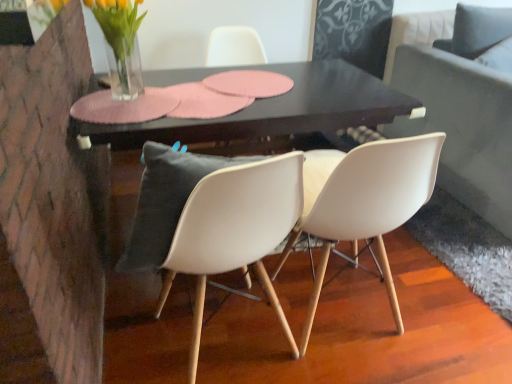
Question: Does white plastic chair at center, acting as the third chair starting from the front, have a greater height compared to clear glass vase at upper left?

Choices:
 (A) no
 (B) yes

Answer: (B)

Question: Can you confirm if white plastic chair at center, the first chair from the back, is bigger than clear glass vase at upper left?

Choices:
 (A) yes
 (B) no

Answer: (A)

Question: Is white plastic chair at center, the first chair from the back, positioned behind clear glass vase at upper left?

Choices:
 (A) no
 (B) yes

Answer: (B)

Question: Can you confirm if white plastic chair at center, the first chair from the back, is thinner than clear glass vase at upper left?

Choices:
 (A) yes
 (B) no

Answer: (B)

Question: From a real-world perspective, is white plastic chair at center, the first chair from the back, on top of clear glass vase at upper left?

Choices:
 (A) yes
 (B) no

Answer: (B)

Question: In terms of size, does white plastic chair at center, the 3th chair viewed from the back, appear bigger or smaller than dark gray fabric couch at right?

Choices:
 (A) small
 (B) big

Answer: (A)

Question: Is point [261, 244] closer or farther from the camera than point [468, 64]?

Choices:
 (A) closer
 (B) farther

Answer: (A)

Question: Relative to dark gray fabric couch at right, is white plastic chair at center, the first chair in the front-to-back sequence, in front or behind?

Choices:
 (A) behind
 (B) front

Answer: (B)

Question: Is white plastic chair at center, the 3th chair viewed from the back, spatially inside dark gray fabric couch at right, or outside of it?

Choices:
 (A) inside
 (B) outside

Answer: (B)

Question: From their relative heights in the image, would you say white plastic chair at center, the first chair in the front-to-back sequence, is taller or shorter than white plastic chair at center, acting as the third chair starting from the front?

Choices:
 (A) short
 (B) tall

Answer: (B)

Question: From a real-world perspective, is white plastic chair at center, the first chair in the front-to-back sequence, physically located above or below white plastic chair at center, the first chair from the back?

Choices:
 (A) above
 (B) below

Answer: (B)

Question: Is white plastic chair at center, the first chair in the front-to-back sequence, bigger or smaller than white plastic chair at center, acting as the third chair starting from the front?

Choices:
 (A) small
 (B) big

Answer: (B)

Question: Considering their positions, is white plastic chair at center, the first chair in the front-to-back sequence, located in front of or behind white plastic chair at center, the first chair from the back?

Choices:
 (A) behind
 (B) front

Answer: (B)

Question: Is white matte chair at center, the 2th chair when ordered from back to front, inside the boundaries of white plastic chair at center, the first chair from the back, or outside?

Choices:
 (A) outside
 (B) inside

Answer: (A)

Question: Looking at the image, does white matte chair at center, the 2th chair when ordered from back to front, seem bigger or smaller compared to white plastic chair at center, the first chair from the back?

Choices:
 (A) big
 (B) small

Answer: (A)